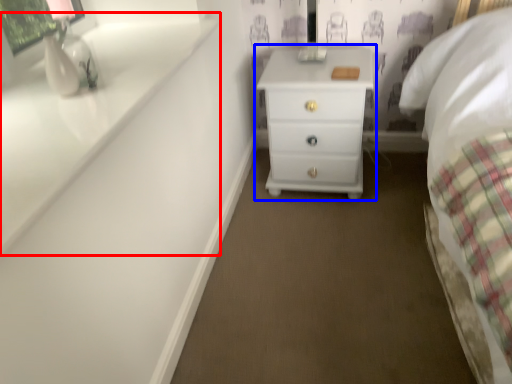
Question: Which object is further to the camera taking this photo, window sill (highlighted by a red box) or chest of drawers (highlighted by a blue box)?

Choices:
 (A) window sill
 (B) chest of drawers

Answer: (B)